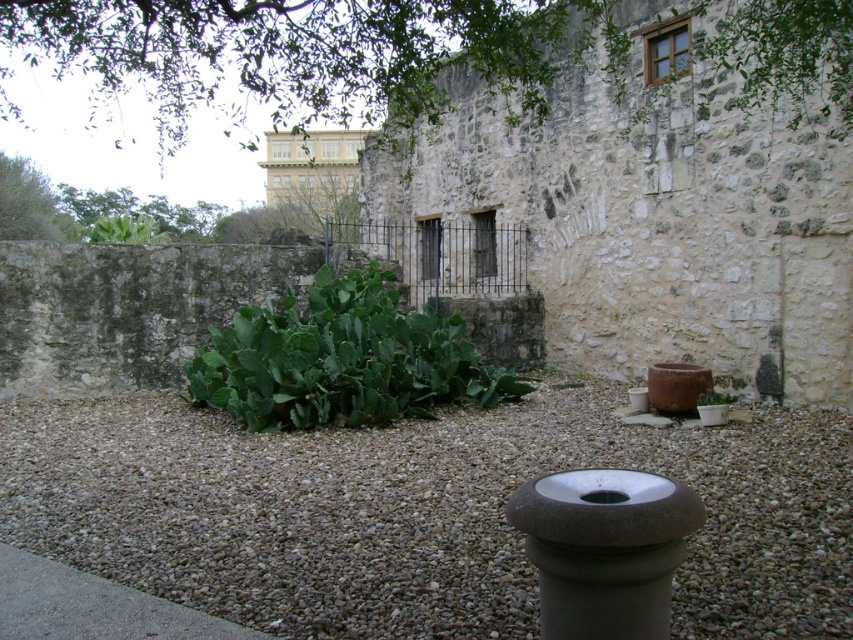
Question: Does gray gravel at center appear over green leafy cactus at center?

Choices:
 (A) yes
 (B) no

Answer: (B)

Question: Which of these objects is positioned farthest from the gray gravel at center?

Choices:
 (A) green leafy cactus at center
 (B) green leafy cactus at upper center

Answer: (B)

Question: Does gray gravel at center have a larger size compared to green leafy cactus at upper center?

Choices:
 (A) no
 (B) yes

Answer: (A)

Question: Is gray gravel at center further to camera compared to green leafy cactus at center?

Choices:
 (A) yes
 (B) no

Answer: (B)

Question: Which object is positioned closest to the green leafy cactus at center?

Choices:
 (A) gray gravel at center
 (B) green leafy cactus at upper center

Answer: (A)

Question: Which point appears farthest from the camera in this image?

Choices:
 (A) (242, 396)
 (B) (86, 544)
 (C) (6, 116)

Answer: (C)